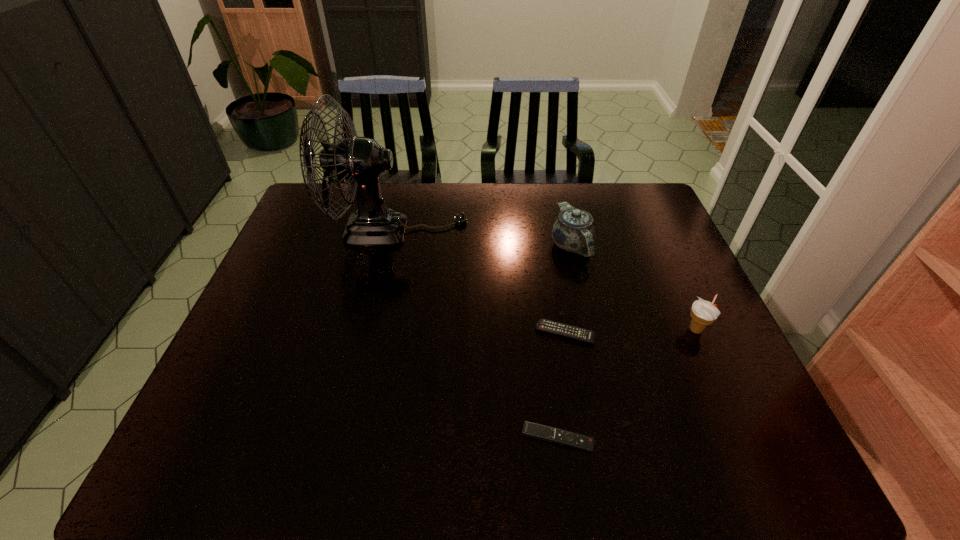
Where is `vacant region at the near left corner`? The image size is (960, 540). vacant region at the near left corner is located at coordinates (203, 475).

This screenshot has height=540, width=960. Identify the location of free space between the chinaware and the nearest object. (564, 342).

Image resolution: width=960 pixels, height=540 pixels. In order to click on vacant area that lies between the farther remote control and the chinaware in this screenshot , I will do `click(568, 289)`.

In order to click on free area in between the fan and the nearest object in this screenshot , I will do `click(477, 334)`.

I want to click on vacant space in between the leftmost object and the chinaware, so [x=485, y=238].

Where is `unoccupied position between the rightmost object and the nearest object`? The height and width of the screenshot is (540, 960). unoccupied position between the rightmost object and the nearest object is located at coordinates (627, 384).

At what (x,y) coordinates should I click in order to perform the action: click on vacant region between the icecream and the farther remote control. Please return your answer as a coordinate pair (x, y). The image size is (960, 540). Looking at the image, I should click on (631, 332).

Image resolution: width=960 pixels, height=540 pixels. In order to click on free space between the tallest object and the farther remote control in this screenshot , I will do `click(481, 282)`.

The height and width of the screenshot is (540, 960). In order to click on vacant point located between the farther remote control and the nearer remote control in this screenshot , I will do `click(562, 386)`.

Identify the location of empty space that is in between the farther remote control and the nearest object. (562, 386).